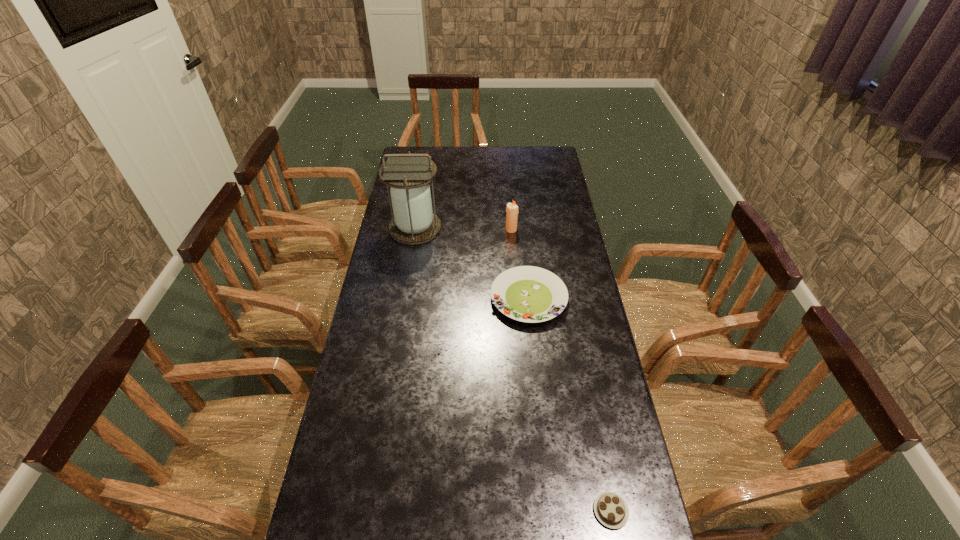
Locate an element on the screen. free space located 0.390m on the back of the shortest object is located at coordinates (581, 359).

Image resolution: width=960 pixels, height=540 pixels. I want to click on object present at the left edge, so click(x=408, y=175).

I want to click on salad plate that is at the right edge, so click(x=530, y=294).

Find the location of a particular element. This screenshot has height=540, width=960. chocolate cake present at the right edge is located at coordinates (610, 508).

Where is `vacant position at the left edge of the desktop`? This screenshot has height=540, width=960. vacant position at the left edge of the desktop is located at coordinates (342, 488).

The image size is (960, 540). In order to click on vacant space at the right edge in this screenshot , I will do `click(559, 224)`.

In order to click on vacant space at the far right corner of the desktop in this screenshot , I will do `click(557, 159)`.

Locate an element on the screen. The width and height of the screenshot is (960, 540). free space between the nearest object and the lantern is located at coordinates (513, 369).

You are a GUI agent. You are given a task and a screenshot of the screen. Output one action in this format:
    pyautogui.click(x=<x>, y=<y>)
    Task: Click on the vacant area that lies between the nearest object and the second shortest object
    
    Given the screenshot: What is the action you would take?
    click(x=569, y=404)

The width and height of the screenshot is (960, 540). What are the coordinates of `unoccupied position between the shortest object and the candle` in the screenshot? It's located at (561, 370).